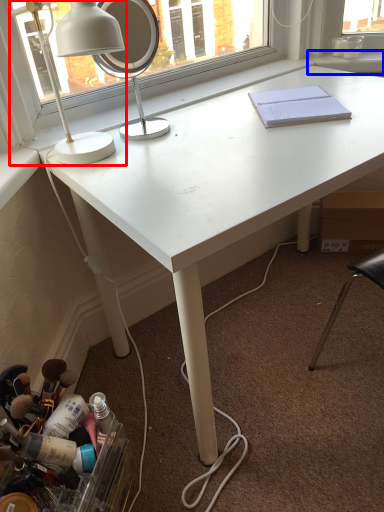
Question: Which point is closer to the camera, lamp (highlighted by a red box) or window sill (highlighted by a blue box)?

Choices:
 (A) lamp
 (B) window sill

Answer: (A)